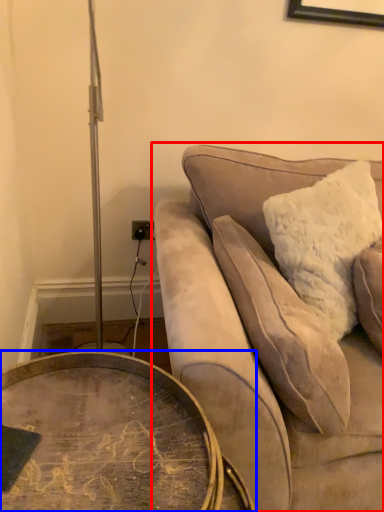
Question: Which object appears closest to the camera in this image, studio couch (highlighted by a red box) or coffee table (highlighted by a blue box)?

Choices:
 (A) studio couch
 (B) coffee table

Answer: (B)